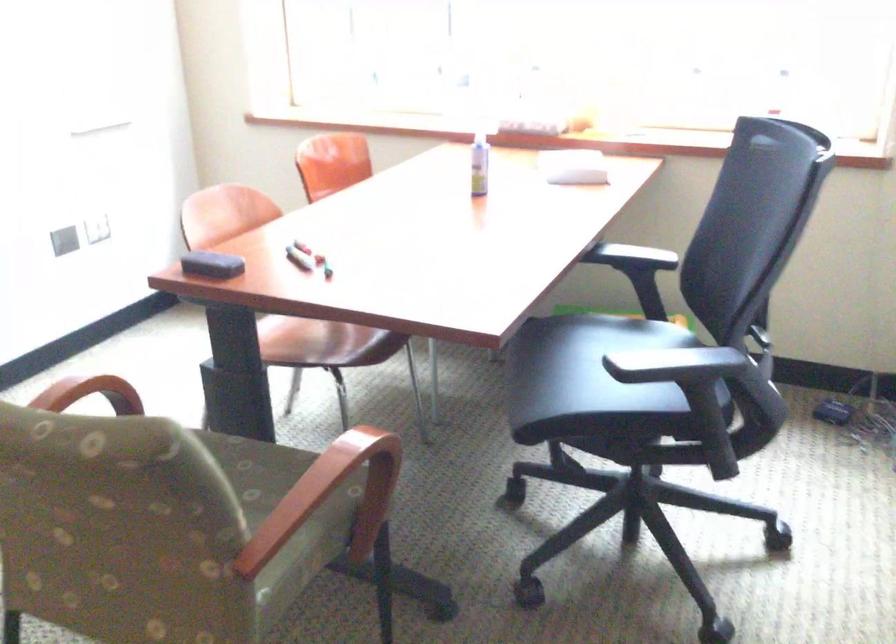
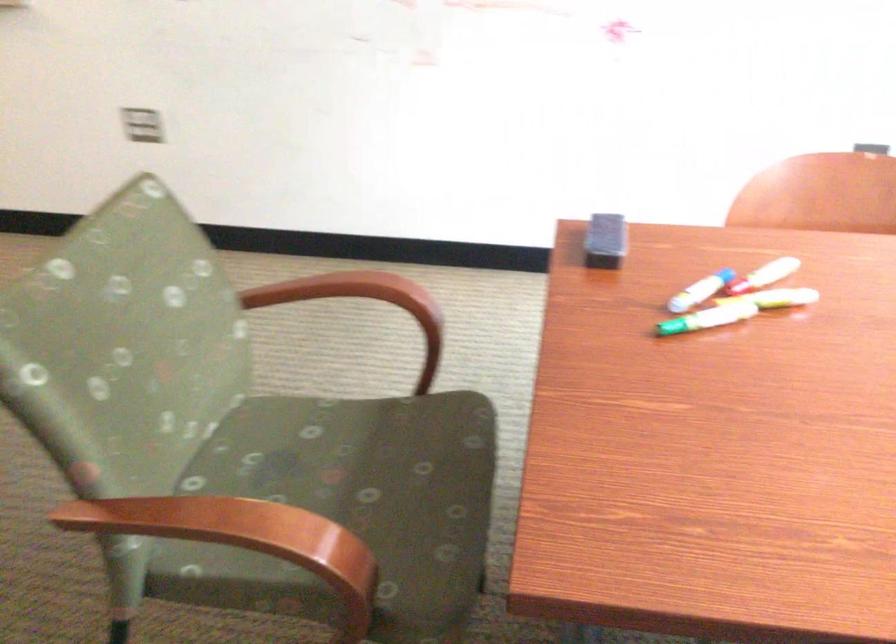
The point at (101, 223) is marked in the first image. Where is the corresponding point in the second image?

(871, 147)